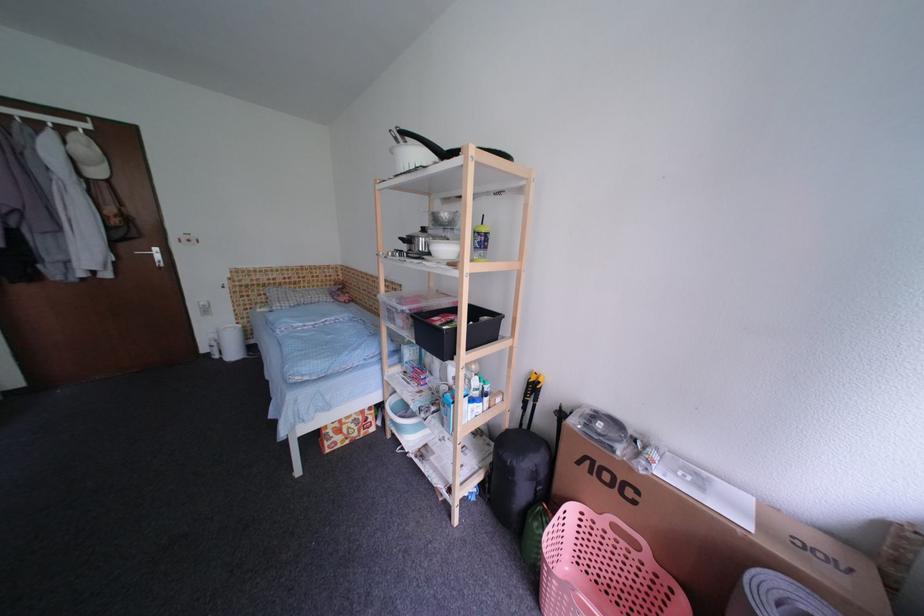
This screenshot has height=616, width=924. What do you see at coordinates (625, 533) in the screenshot? I see `the pink basket handle` at bounding box center [625, 533].